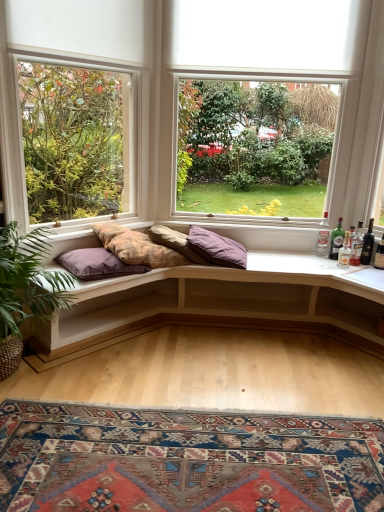
Question: Considering the relative positions of wooden cushioned bench at center and green glass bottle at right, the third bottle viewed from the right, in the image provided, is wooden cushioned bench at center to the right of green glass bottle at right, the third bottle viewed from the right, from the viewer's perspective?

Choices:
 (A) yes
 (B) no

Answer: (B)

Question: Can you confirm if wooden cushioned bench at center is thinner than green glass bottle at right, the 3th bottle viewed from the left?

Choices:
 (A) yes
 (B) no

Answer: (B)

Question: From the image's perspective, is wooden cushioned bench at center under green glass bottle at right, the third bottle viewed from the right?

Choices:
 (A) yes
 (B) no

Answer: (A)

Question: Is wooden cushioned bench at center shorter than green glass bottle at right, the third bottle viewed from the right?

Choices:
 (A) yes
 (B) no

Answer: (B)

Question: Does wooden cushioned bench at center come in front of green glass bottle at right, the third bottle viewed from the right?

Choices:
 (A) yes
 (B) no

Answer: (A)

Question: Considering the positions of purple soft cushion at center, placed as the third pillow when sorted from left to right, and carpeted rug at lower center in the image, is purple soft cushion at center, placed as the third pillow when sorted from left to right, bigger or smaller than carpeted rug at lower center?

Choices:
 (A) big
 (B) small

Answer: (B)

Question: Choose the correct answer: Is purple soft cushion at center, which is the 1th pillow in right-to-left order, inside carpeted rug at lower center or outside it?

Choices:
 (A) outside
 (B) inside

Answer: (A)

Question: Relative to carpeted rug at lower center, is purple soft cushion at center, placed as the third pillow when sorted from left to right, in front or behind?

Choices:
 (A) front
 (B) behind

Answer: (B)

Question: In terms of width, does purple soft cushion at center, placed as the third pillow when sorted from left to right, look wider or thinner when compared to carpeted rug at lower center?

Choices:
 (A) thin
 (B) wide

Answer: (A)

Question: Relative to wooden cushioned bench at center, is textured cotton cushions at center in front or behind?

Choices:
 (A) behind
 (B) front

Answer: (A)

Question: Based on their sizes in the image, would you say textured cotton cushions at center is bigger or smaller than wooden cushioned bench at center?

Choices:
 (A) small
 (B) big

Answer: (A)

Question: From the image's perspective, relative to wooden cushioned bench at center, is textured cotton cushions at center above or below?

Choices:
 (A) below
 (B) above

Answer: (B)

Question: Is point (96, 270) closer or farther from the camera than point (152, 282)?

Choices:
 (A) farther
 (B) closer

Answer: (B)

Question: Would you say matte white window at center, placed as the 1th window when sorted from left to right, is inside or outside translucent glass bottle at right, which is counted as the 5th bottle, starting from the left?

Choices:
 (A) inside
 (B) outside

Answer: (B)

Question: Is matte white window at center, the second window positioned from the right, taller or shorter than translucent glass bottle at right, which is counted as the 5th bottle, starting from the left?

Choices:
 (A) short
 (B) tall

Answer: (B)